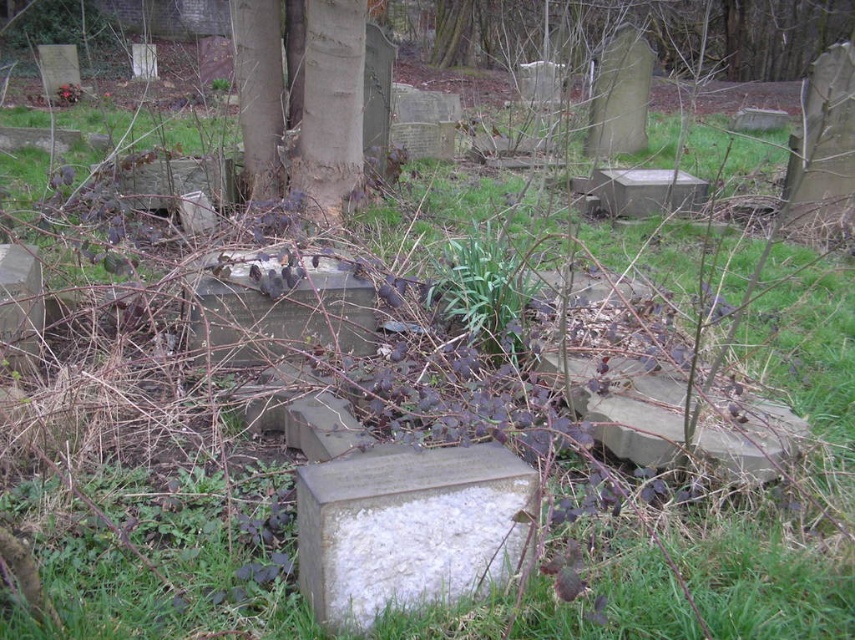
Question: Considering the real-world distances, which object is closest to the white stone gravestone at center?

Choices:
 (A) smooth gray stone at center
 (B) brown rough bark at center
 (C) smooth bark tree at upper center
 (D) green leafy plant at center

Answer: (A)

Question: Can you confirm if smooth bark tree at upper center is positioned to the right of gray stone gravestone at center?

Choices:
 (A) yes
 (B) no

Answer: (A)

Question: Does smooth bark tree at upper center come behind gray stone gravestone at center?

Choices:
 (A) yes
 (B) no

Answer: (A)

Question: Which object appears closest to the camera in this image?

Choices:
 (A) smooth gray stone at lower left
 (B) green leafy plant at center
 (C) white stone gravestone at center
 (D) smooth gray stone at center

Answer: (C)

Question: Which of these objects is positioned farthest from the white stone gravestone at center?

Choices:
 (A) smooth gray stone at lower left
 (B) smooth gray stone at center
 (C) green leafy plant at center

Answer: (A)

Question: Is smooth bark tree at upper center further to camera compared to brown rough bark at center?

Choices:
 (A) no
 (B) yes

Answer: (B)